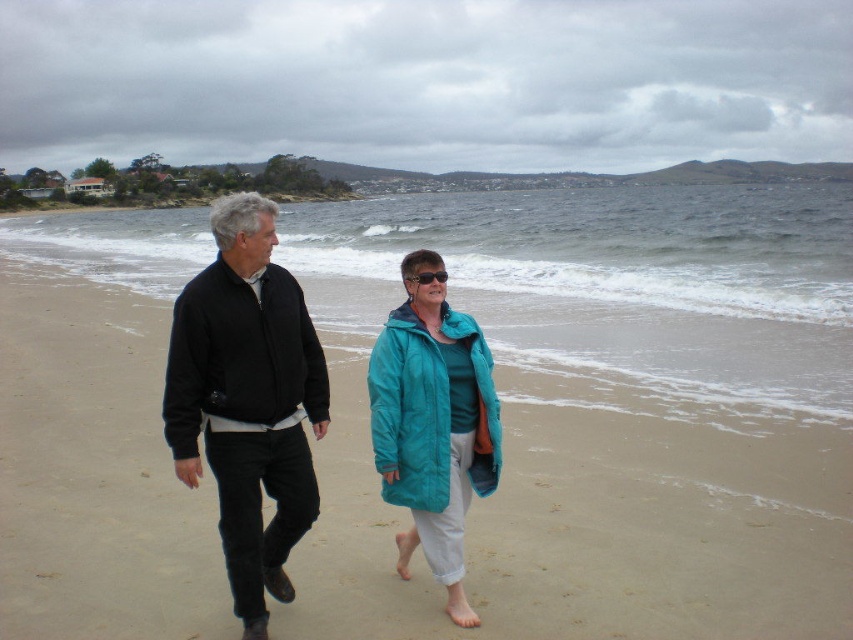
Who is more forward, (234, 593) or (413, 534)?

Point (234, 593)

Can you confirm if black cotton jacket at left is shorter than teal puffy coat at center?

No.

The image size is (853, 640). I want to click on black cotton jacket at left, so click(247, 401).

Which is below, beige sand at center or teal puffy coat at center?

beige sand at center is lower down.

Consider the image. Is beige sand at center smaller than teal puffy coat at center?

No, beige sand at center is not smaller than teal puffy coat at center.

Identify the location of beige sand at center. The width and height of the screenshot is (853, 640). (592, 532).

Identify the location of beige sand at center. (592, 532).

Which is in front, point (97, 346) or point (223, 540)?

Positioned in front is point (223, 540).

Can you confirm if beige sand at center is positioned above black cotton jacket at left?

No.

Measure the distance between point (526, 636) and camera.

They are 12.87 feet apart.

The image size is (853, 640). What are the coordinates of `beige sand at center` in the screenshot? It's located at (592, 532).